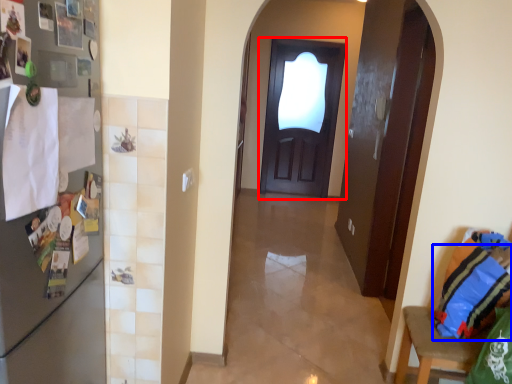
Question: Which of the following is the farthest to the observer, door (highlighted by a red box) or pillow (highlighted by a blue box)?

Choices:
 (A) door
 (B) pillow

Answer: (A)